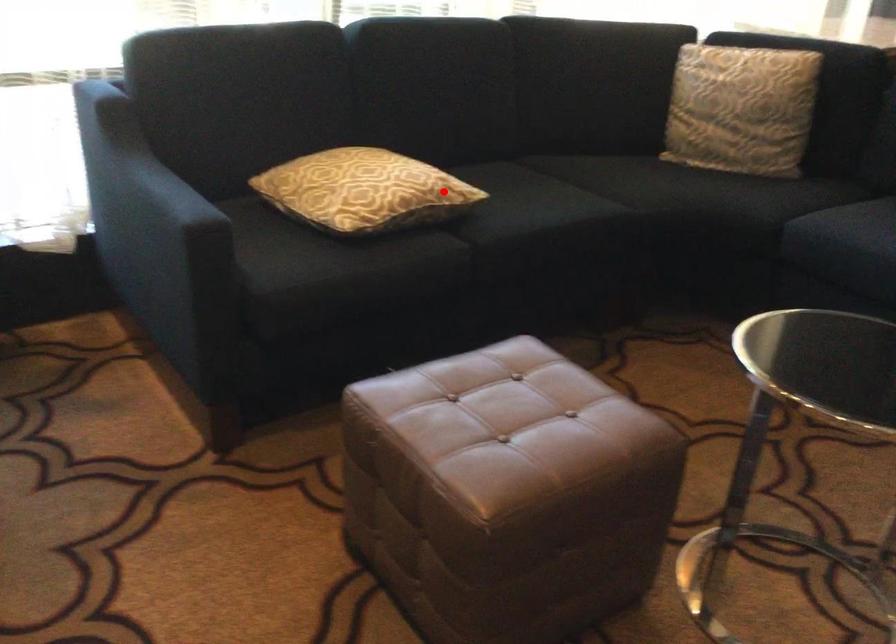
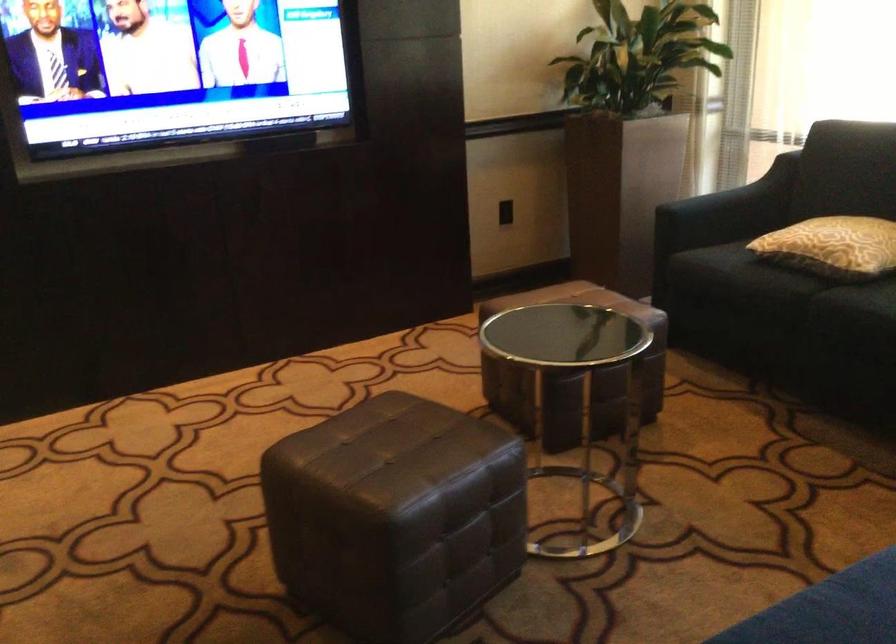
Locate, in the second image, the point that corresponds to the highlighted location in the first image.

(832, 245)